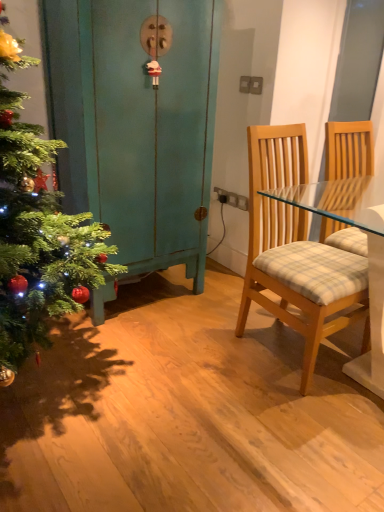
What do you see at coordinates (136, 125) in the screenshot? The width and height of the screenshot is (384, 512). I see `teal painted wood dresser at left` at bounding box center [136, 125].

At what (x,y) coordinates should I click in order to perform the action: click on teal painted wood dresser at left. Please return your answer as a coordinate pair (x, y). Looking at the image, I should click on (136, 125).

The image size is (384, 512). Describe the element at coordinates (295, 250) in the screenshot. I see `light wood/glass chair at right` at that location.

The image size is (384, 512). Find the location of `light wood/glass chair at right`. light wood/glass chair at right is located at coordinates (295, 250).

Where is `teal painted wood dresser at left`? This screenshot has height=512, width=384. teal painted wood dresser at left is located at coordinates (136, 125).

Is teal painted wood dresser at left to the left of light wood/glass chair at right from the viewer's perspective?

Yes.

Which object is more forward, teal painted wood dresser at left or light wood/glass chair at right?

light wood/glass chair at right.

Which point is more distant from viewer, (64, 59) or (338, 305)?

The point (64, 59) is farther from the camera.

From the image's perspective, is teal painted wood dresser at left located above or below light wood/glass chair at right?

Based on their image positions, teal painted wood dresser at left is located above light wood/glass chair at right.

From a real-world perspective, who is located lower, teal painted wood dresser at left or light wood/glass chair at right?

light wood/glass chair at right is physically lower.

Considering the sizes of objects teal painted wood dresser at left and light wood/glass chair at right in the image provided, who is thinner, teal painted wood dresser at left or light wood/glass chair at right?

With smaller width is teal painted wood dresser at left.

Is teal painted wood dresser at left taller than light wood/glass chair at right?

Yes, teal painted wood dresser at left is taller than light wood/glass chair at right.

Which of these two, teal painted wood dresser at left or light wood/glass chair at right, is smaller?

light wood/glass chair at right is smaller.

Would you say teal painted wood dresser at left is inside or outside light wood/glass chair at right?

teal painted wood dresser at left lies outside light wood/glass chair at right.

Are teal painted wood dresser at left and light wood/glass chair at right far apart?

That's not correct — teal painted wood dresser at left is a little close to light wood/glass chair at right.

Is teal painted wood dresser at left oriented towards light wood/glass chair at right?

Yes, teal painted wood dresser at left is aimed at light wood/glass chair at right.

Can you tell me how much teal painted wood dresser at left and light wood/glass chair at right differ in facing direction?

2.85 degrees.

Find the location of a particular element. The width and height of the screenshot is (384, 512). chair that appears below the teal painted wood dresser at left (from the image's perspective) is located at coordinates (295, 250).

Considering the relative positions of light wood/glass chair at right and teal painted wood dresser at left in the image provided, is light wood/glass chair at right to the left or to the right of teal painted wood dresser at left?

From the image, it's evident that light wood/glass chair at right is to the right of teal painted wood dresser at left.

In the image, is light wood/glass chair at right positioned in front of or behind teal painted wood dresser at left?

Visually, light wood/glass chair at right is located in front of teal painted wood dresser at left.

Does point (264, 155) lie behind point (184, 54)?

No, (264, 155) is in front of (184, 54).

In the scene shown: From the image's perspective, is light wood/glass chair at right located above teal painted wood dresser at left?

Actually, light wood/glass chair at right appears below teal painted wood dresser at left in the image.

From a real-world perspective, which object rests below the other?

light wood/glass chair at right is physically lower.

Which object is thinner, light wood/glass chair at right or teal painted wood dresser at left?

Thinner between the two is teal painted wood dresser at left.

Between light wood/glass chair at right and teal painted wood dresser at left, which one has more height?

teal painted wood dresser at left is taller.

Which of these two, light wood/glass chair at right or teal painted wood dresser at left, is bigger?

With larger size is teal painted wood dresser at left.

Is light wood/glass chair at right outside of teal painted wood dresser at left?

Yes.

Is light wood/glass chair at right beside teal painted wood dresser at left?

No, light wood/glass chair at right is not with teal painted wood dresser at left.

Is light wood/glass chair at right looking in the opposite direction of teal painted wood dresser at left?

Yes.

You are a GUI agent. You are given a task and a screenshot of the screen. Output one action in this format:
    pyautogui.click(x=<x>, y=<y>)
    Task: Click on the dresser on the left of light wood/glass chair at right
    
    Given the screenshot: What is the action you would take?
    pyautogui.click(x=136, y=125)

Image resolution: width=384 pixels, height=512 pixels. What are the coordinates of `dresser located on the left of light wood/glass chair at right` in the screenshot? It's located at (136, 125).

I want to click on chair below the teal painted wood dresser at left (from the image's perspective), so click(295, 250).